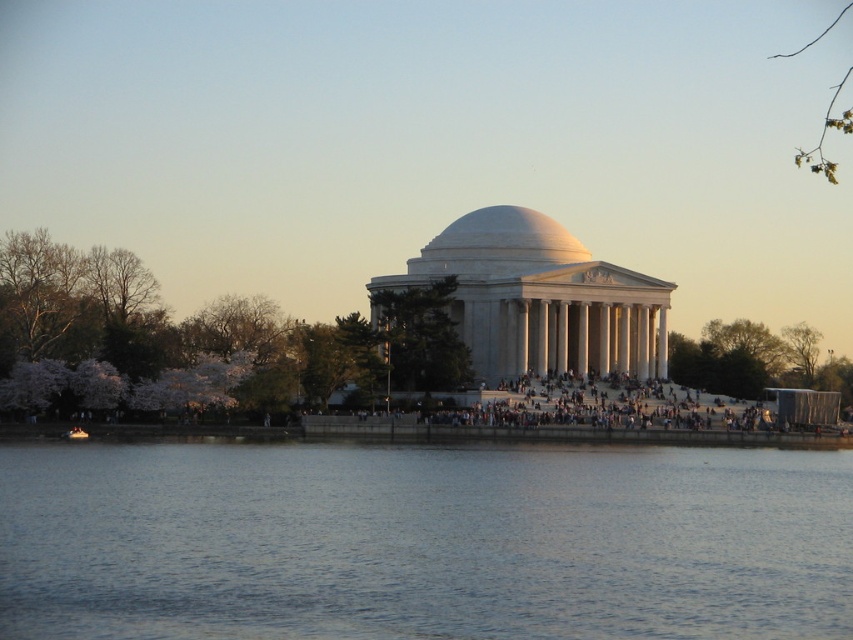
You are standing at the center of the Jefferson Memorial and want to take a photo of the pink blossoms at left. In which direction should you point your camera to capture them?

The pink blossoms at left are located at point (x=198, y=340) in the image. Since you are at the center, you should point your camera to the left to capture them.

You are standing in front of the Jefferson Memorial and notice the blue water at center and the green leafy branch at upper right. Which object is positioned to the left of the other?

The blue water at center is to the left of green leafy branch at upper right.

You are standing at the Jefferson Memorial and notice two green leafy elements in the scene. Which one is shorter, the green leafy tree at lower right or the green leafy branch at upper right?

The green leafy tree at lower right is shorter than the green leafy branch at upper right.